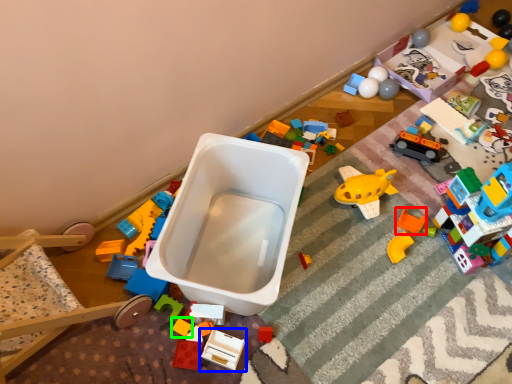
Question: Which is nearer to the toy (highlighted by a red box)? toy (highlighted by a blue box) or toy (highlighted by a green box).

Choices:
 (A) toy
 (B) toy

Answer: (A)